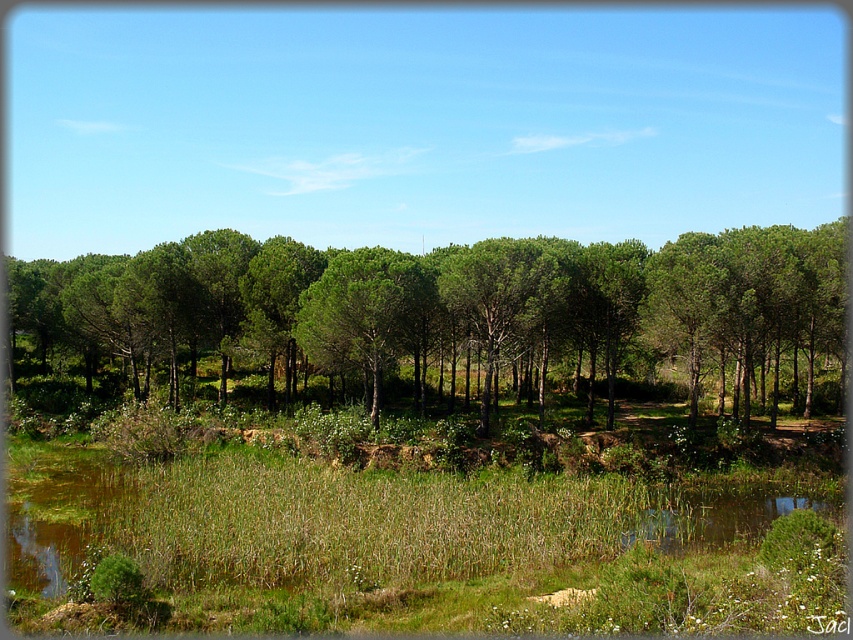
You are planning to plant a new tree in this landscape. The green leafy tree at center and the green matte tree at center are already present. Which tree has a wider canopy that might require more space?

The green leafy tree at center has a larger width than the green matte tree at center, so it requires more space due to its wider canopy.

You are standing in the pine grove and see two points marked in the image. Which point is closer to you, point (549, 316) or point (386, 310)?

Point (386, 310) is closer to you because it is less further to the viewer than point (549, 316).